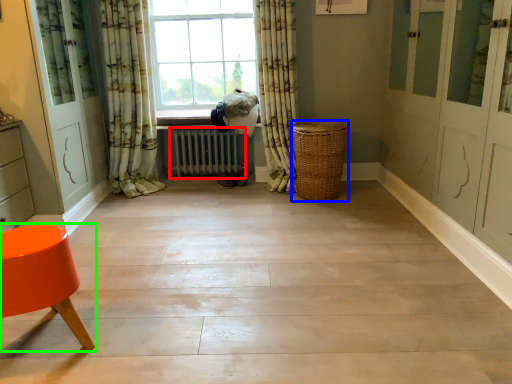
Question: Which object is positioned closest to radiator (highlighted by a red box)? Select from basket (highlighted by a blue box) and chair (highlighted by a green box).

Choices:
 (A) basket
 (B) chair

Answer: (A)